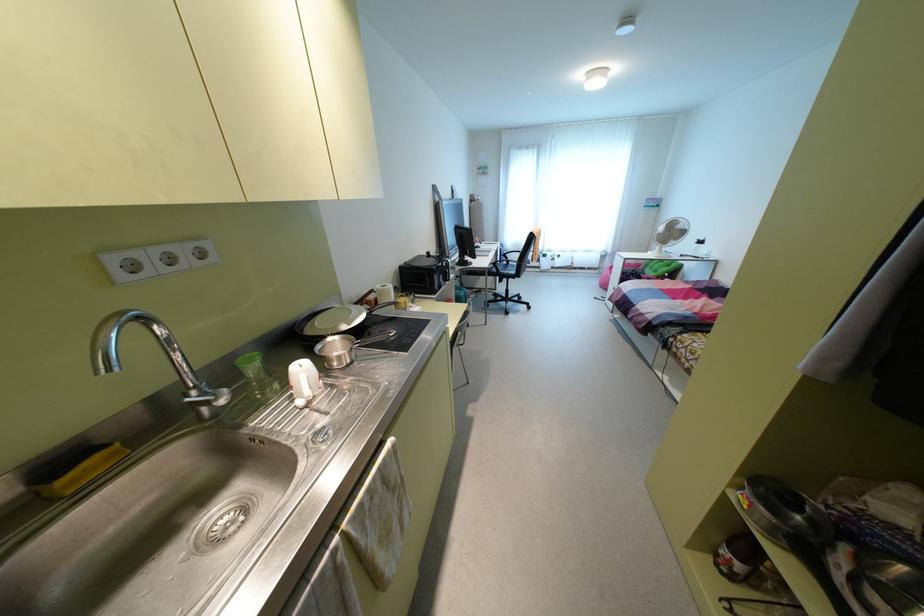
Find the location of a particular element. silver faucet handle is located at coordinates (204, 397).